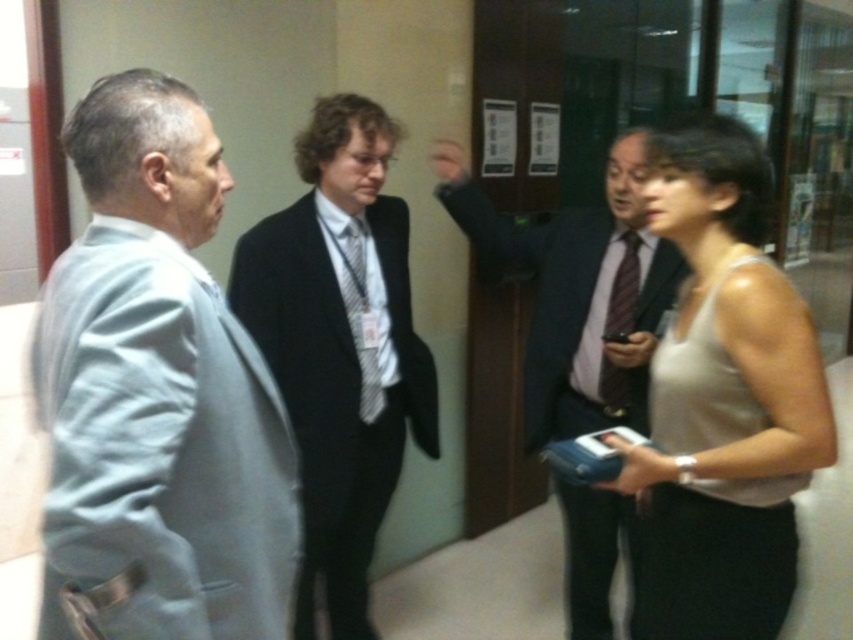
Is point (775, 339) positioned after point (576, 422)?

No, it is not.

Is beige fabric tank top at right above matte black suit at center?

No.

Does point (764, 266) lie behind point (566, 433)?

No, (764, 266) is in front of (566, 433).

Identify the location of beige fabric tank top at right. The height and width of the screenshot is (640, 853). (723, 400).

Where is `gray fabric suit at left`? gray fabric suit at left is located at coordinates (155, 396).

Is gray fabric suit at left in front of black suit at center?

Yes, it is in front of black suit at center.

Between gray fabric suit at left and black suit at center, which one appears on the left side from the viewer's perspective?

gray fabric suit at left is more to the left.

Which is behind, point (74, 342) or point (372, 355)?

Positioned behind is point (372, 355).

Find the location of `gray fabric suit at left`. gray fabric suit at left is located at coordinates (155, 396).